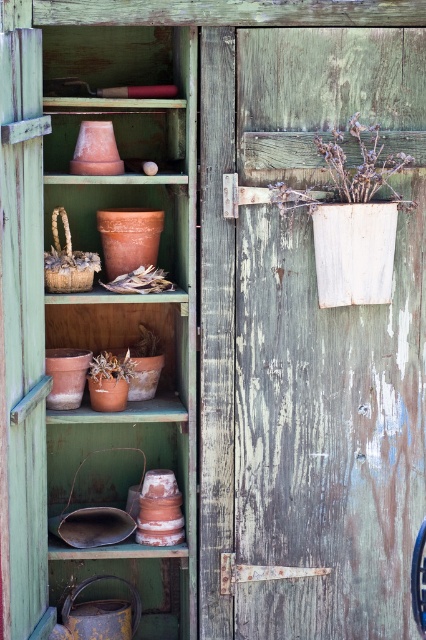
You are organizing the contents of the cabinet and need to place a new item that requires a taller space. Which object between the terracotta clay pots at left and the matte brown pot at lower center should you choose to accommodate the item?

The terracotta clay pots at left is taller than the matte brown pot at lower center, so you should choose the terracotta clay pots at left to accommodate the item needing taller space.